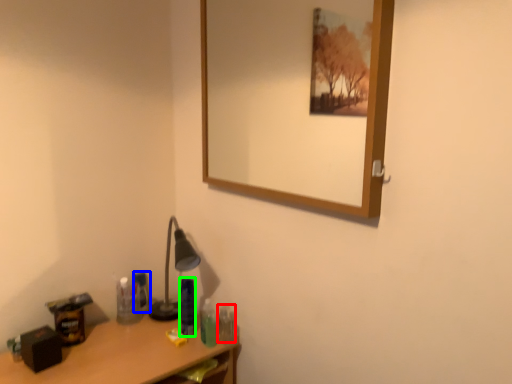
Question: Based on their relative distances, which object is farther from toiletry (highlighted by a red box)? Choose from toiletry (highlighted by a blue box) and toiletry (highlighted by a green box).

Choices:
 (A) toiletry
 (B) toiletry

Answer: (A)